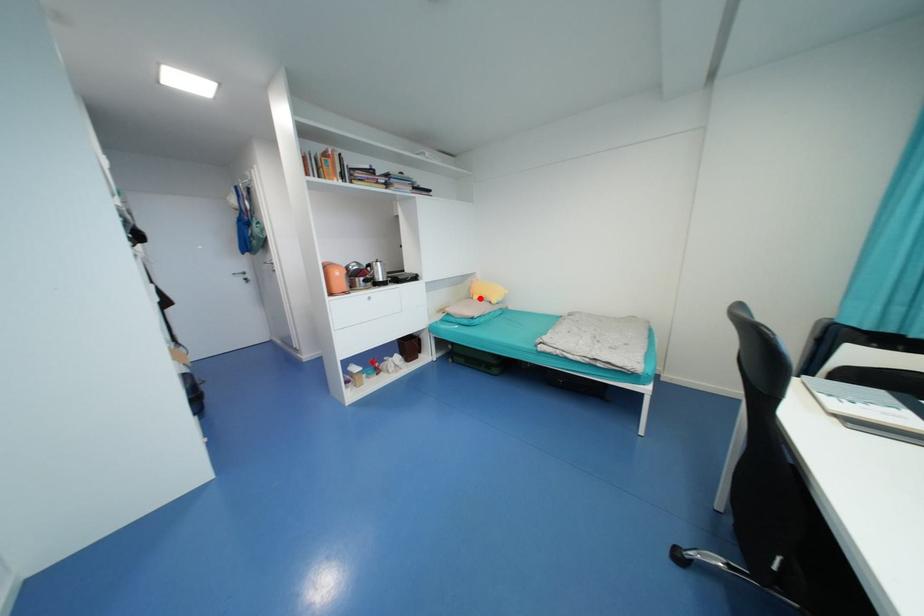
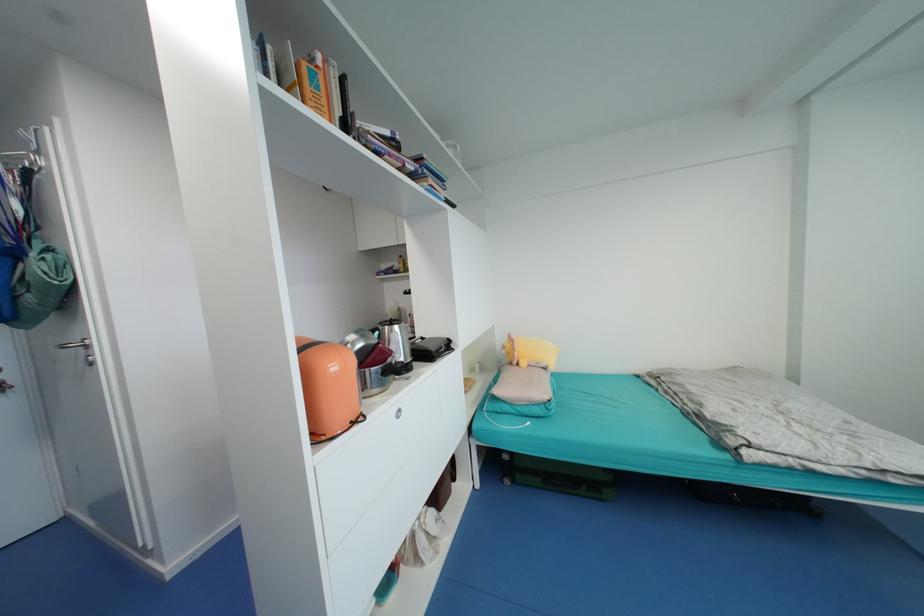
Question: I am providing you with two images of the same scene from different viewpoints. Image1 has a red point marked. In image2, the corresponding 3D location appears at what relative position? Reply with the corresponding letter.

Choices:
 (A) Closer
 (B) Farther

Answer: (B)